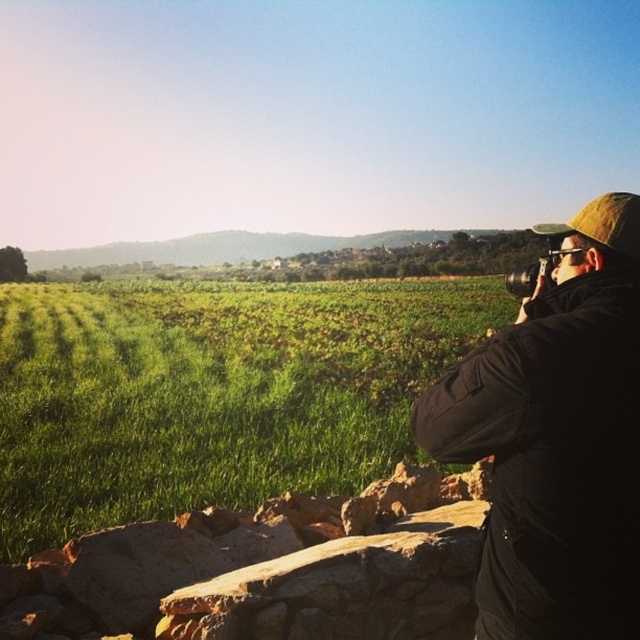
Question: Does black fabric camera at right come behind black plastic camera at upper right?

Choices:
 (A) no
 (B) yes

Answer: (A)

Question: From the image, what is the correct spatial relationship of black fabric camera at right in relation to black plastic camera at upper right?

Choices:
 (A) above
 (B) below

Answer: (B)

Question: Which of the following is the closest to the observer?

Choices:
 (A) (557, 260)
 (B) (529, 570)

Answer: (B)

Question: Is black fabric camera at right bigger than black plastic camera at upper right?

Choices:
 (A) no
 (B) yes

Answer: (A)

Question: Which point appears farthest from the camera in this image?

Choices:
 (A) (531, 292)
 (B) (506, 412)

Answer: (A)